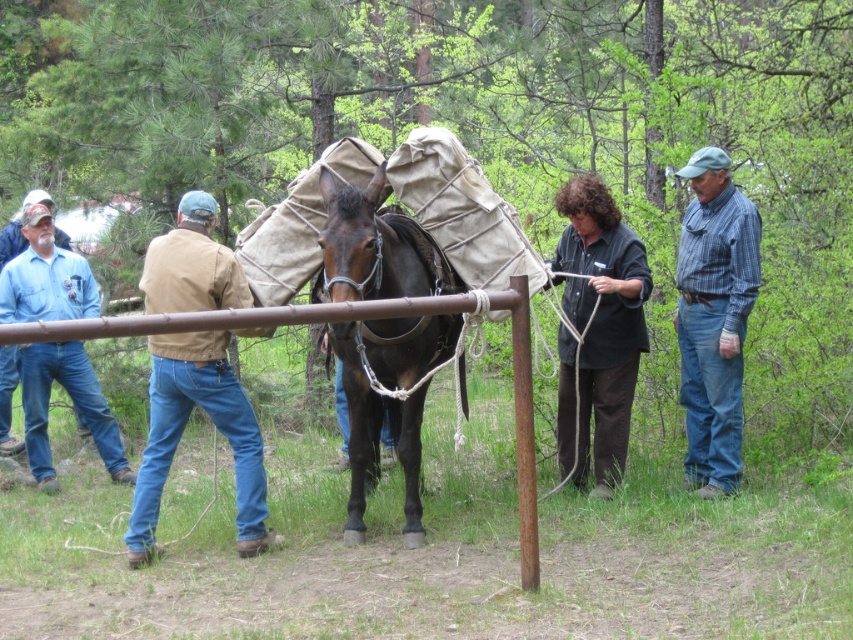
Question: Is brown matte horse at center wider than blue plaid shirt at center right?

Choices:
 (A) yes
 (B) no

Answer: (A)

Question: Considering the real-world distances, which object is farthest from the brown canvas jacket at left?

Choices:
 (A) blue denim jeans at left
 (B) brown matte horse at center
 (C) blue plaid shirt at center right

Answer: (C)

Question: Considering the real-world distances, which object is farthest from the blue plaid shirt at center right?

Choices:
 (A) brown canvas jacket at left
 (B) brown matte horse at center
 (C) blue denim jeans at left

Answer: (C)

Question: Which of these objects is positioned closest to the black matte shirt at center?

Choices:
 (A) blue plaid shirt at center right
 (B) brown matte horse at center
 (C) brown canvas jacket at left
 (D) blue denim jeans at left

Answer: (A)

Question: Does brown matte horse at center lie behind blue plaid shirt at center right?

Choices:
 (A) yes
 (B) no

Answer: (B)

Question: Does brown matte horse at center appear under blue denim jeans at left?

Choices:
 (A) no
 (B) yes

Answer: (A)